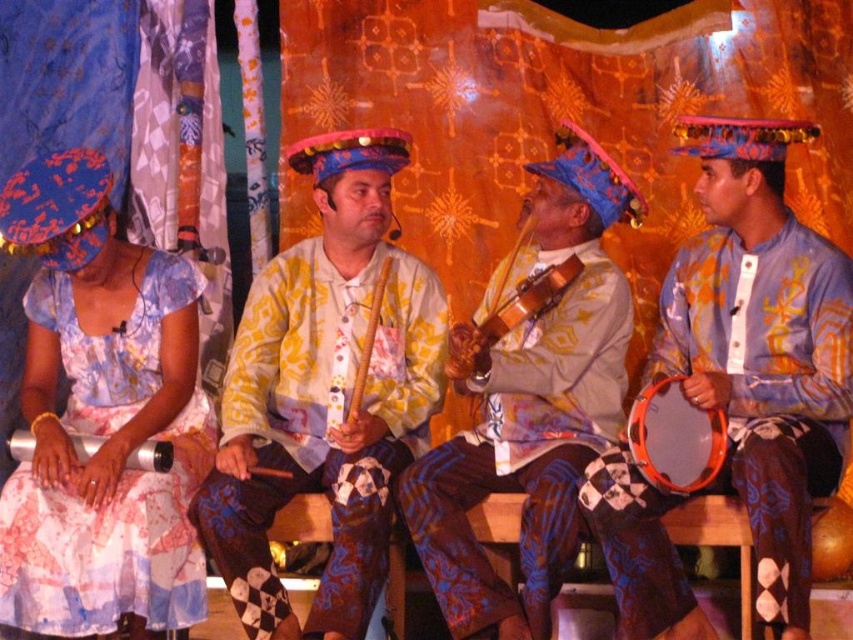
Does matte yellow and white shirt at center come in front of matte yellow shirt at center?

Yes, matte yellow and white shirt at center is in front of matte yellow shirt at center.

Between point (352, 586) and point (577, 384), which one is positioned behind?

Point (577, 384)

Locate an element on the screen. Image resolution: width=853 pixels, height=640 pixels. matte yellow and white shirt at center is located at coordinates (325, 394).

Can you confirm if matte floral dress at left is wider than matte blue drum at right?

Indeed, matte floral dress at left has a greater width compared to matte blue drum at right.

Is matte floral dress at left smaller than matte blue drum at right?

Indeed, matte floral dress at left has a smaller size compared to matte blue drum at right.

Locate an element on the screen. This screenshot has width=853, height=640. matte floral dress at left is located at coordinates (102, 417).

Based on the photo, between matte floral dress at left and orange plastic drum at lower right, which one appears on the left side from the viewer's perspective?

matte floral dress at left

Find the location of `matte floral dress at left`. matte floral dress at left is located at coordinates (102, 417).